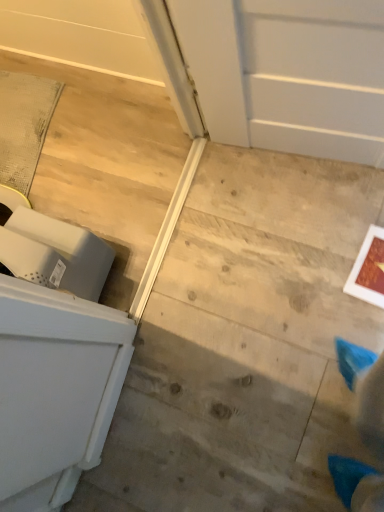
The image size is (384, 512). What do you see at coordinates (245, 343) in the screenshot?
I see `wooden floor at center` at bounding box center [245, 343].

In order to click on wooden floor at center in this screenshot , I will do `click(245, 343)`.

This screenshot has height=512, width=384. I want to click on wooden floor at center, so click(x=245, y=343).